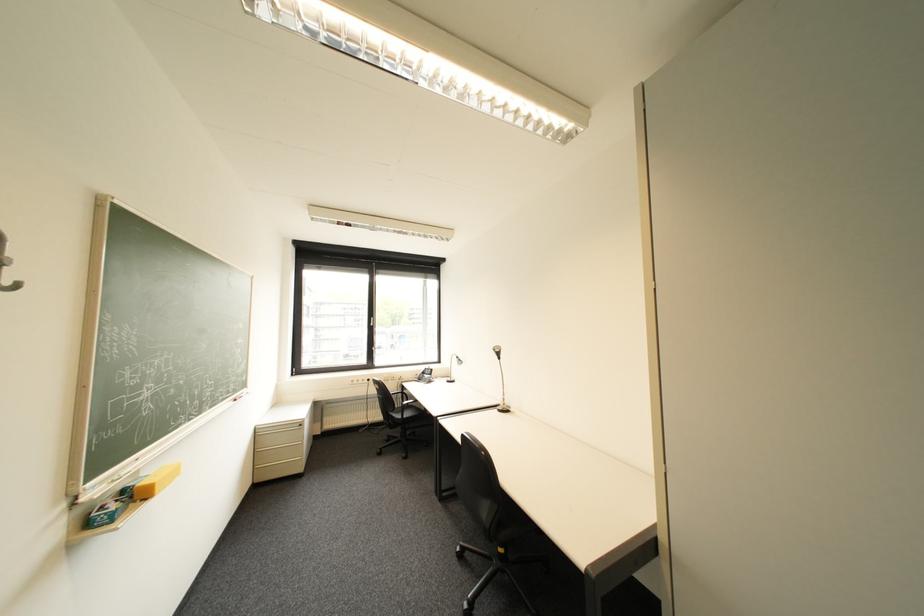
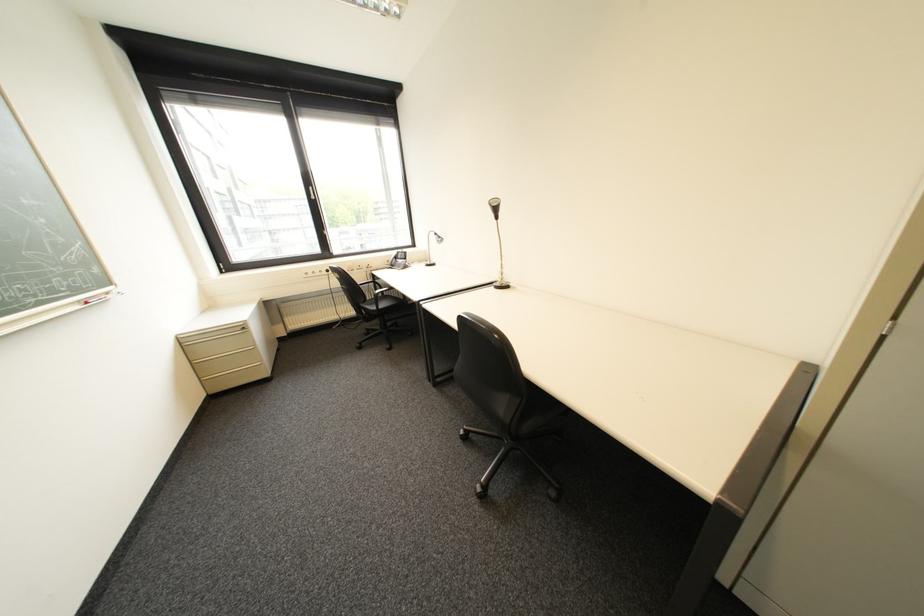
Question: Based on the continuous images, in which direction is the camera rotating? Reply with the corresponding letter.

Choices:
 (A) Left
 (B) Right
 (C) Up
 (D) Down

Answer: (D)